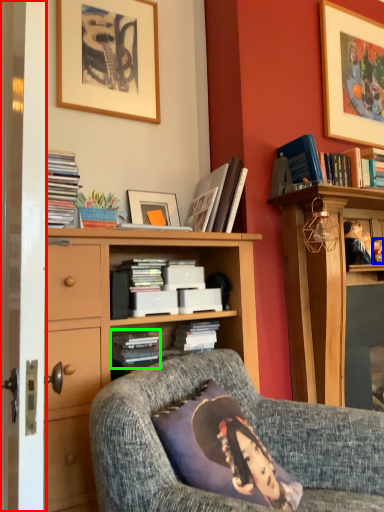
Question: Which is farther away from screen door (highlighted by a red box)? person (highlighted by a blue box) or book (highlighted by a green box)?

Choices:
 (A) person
 (B) book

Answer: (A)